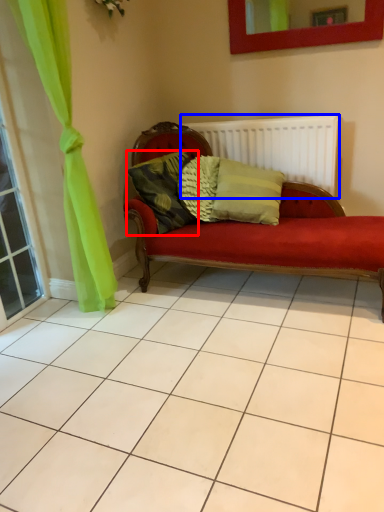
Question: Which object appears farthest to the camera in this image, pillow (highlighted by a red box) or radiator (highlighted by a blue box)?

Choices:
 (A) pillow
 (B) radiator

Answer: (B)